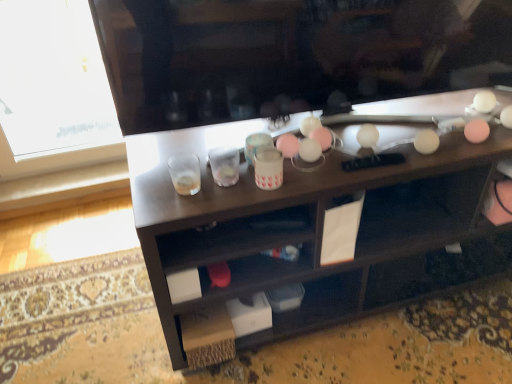
The image size is (512, 384). I want to click on vacant space to the right of pink matte cup at center, so click(323, 170).